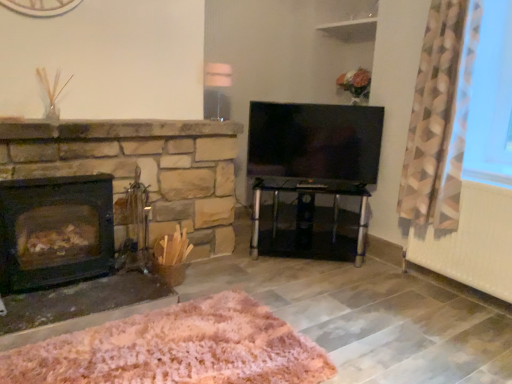
Question: Is white painted radiator at lower right smaller than transparent glass table at center?

Choices:
 (A) no
 (B) yes

Answer: (B)

Question: Is the depth of white painted radiator at lower right less than that of transparent glass table at center?

Choices:
 (A) yes
 (B) no

Answer: (A)

Question: Is white painted radiator at lower right to the right of transparent glass table at center from the viewer's perspective?

Choices:
 (A) yes
 (B) no

Answer: (A)

Question: Is transparent glass table at center inside white painted radiator at lower right?

Choices:
 (A) no
 (B) yes

Answer: (A)

Question: Can you confirm if white painted radiator at lower right is taller than transparent glass table at center?

Choices:
 (A) no
 (B) yes

Answer: (B)

Question: Would you consider white painted radiator at lower right to be distant from transparent glass table at center?

Choices:
 (A) yes
 (B) no

Answer: (B)

Question: Does geometric-patterned fabric at right have a lesser width compared to flat-screen tv at center?

Choices:
 (A) yes
 (B) no

Answer: (B)

Question: Does geometric-patterned fabric at right come behind flat-screen tv at center?

Choices:
 (A) no
 (B) yes

Answer: (A)

Question: Is geometric-patterned fabric at right at the left side of flat-screen tv at center?

Choices:
 (A) no
 (B) yes

Answer: (A)

Question: Is geometric-patterned fabric at right at the right side of flat-screen tv at center?

Choices:
 (A) no
 (B) yes

Answer: (B)

Question: Would you consider geometric-patterned fabric at right to be distant from flat-screen tv at center?

Choices:
 (A) yes
 (B) no

Answer: (B)

Question: Does geometric-patterned fabric at right have a larger size compared to flat-screen tv at center?

Choices:
 (A) no
 (B) yes

Answer: (B)

Question: Considering the relative sizes of flat-screen tv at center and white painted radiator at lower right in the image provided, is flat-screen tv at center smaller than white painted radiator at lower right?

Choices:
 (A) no
 (B) yes

Answer: (B)